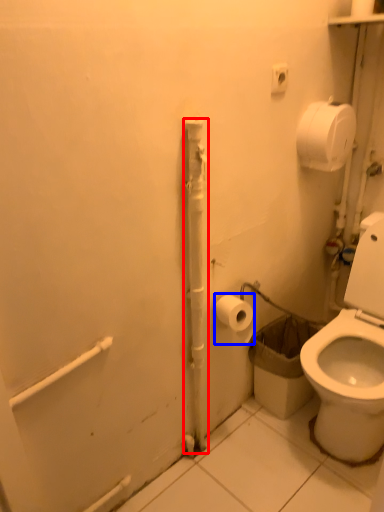
Question: Among these objects, which one is nearest to the camera, pipe (highlighted by a red box) or toilet paper (highlighted by a blue box)?

Choices:
 (A) pipe
 (B) toilet paper

Answer: (A)